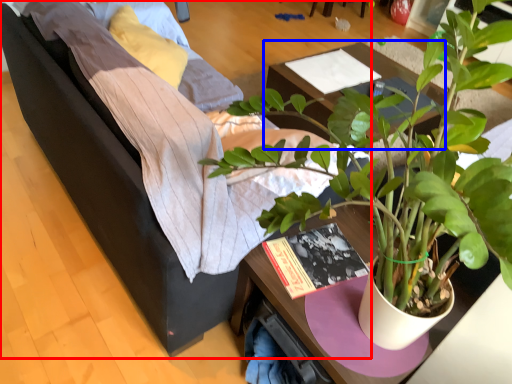
Question: Which of the following is the farthest to the observer, studio couch (highlighted by a red box) or table (highlighted by a blue box)?

Choices:
 (A) studio couch
 (B) table

Answer: (B)